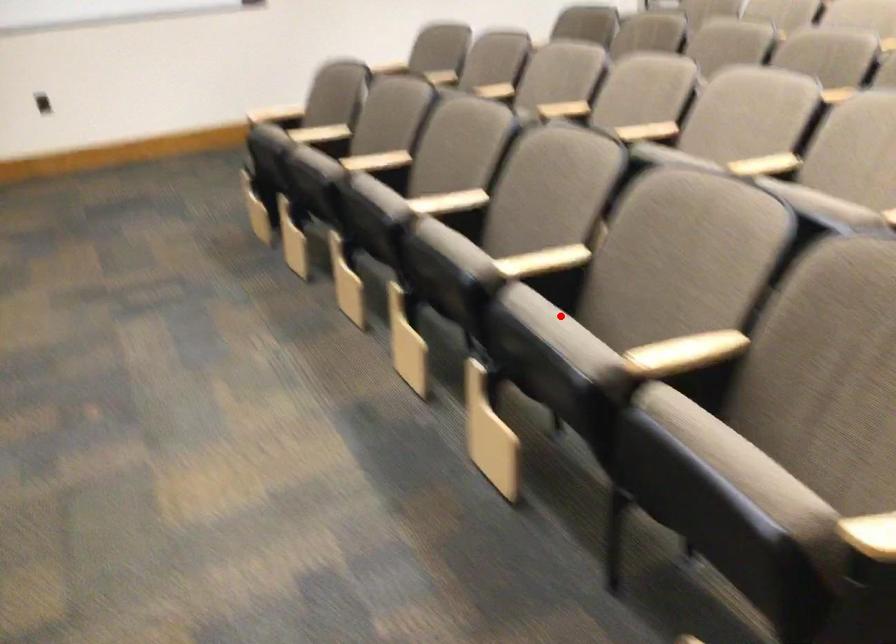
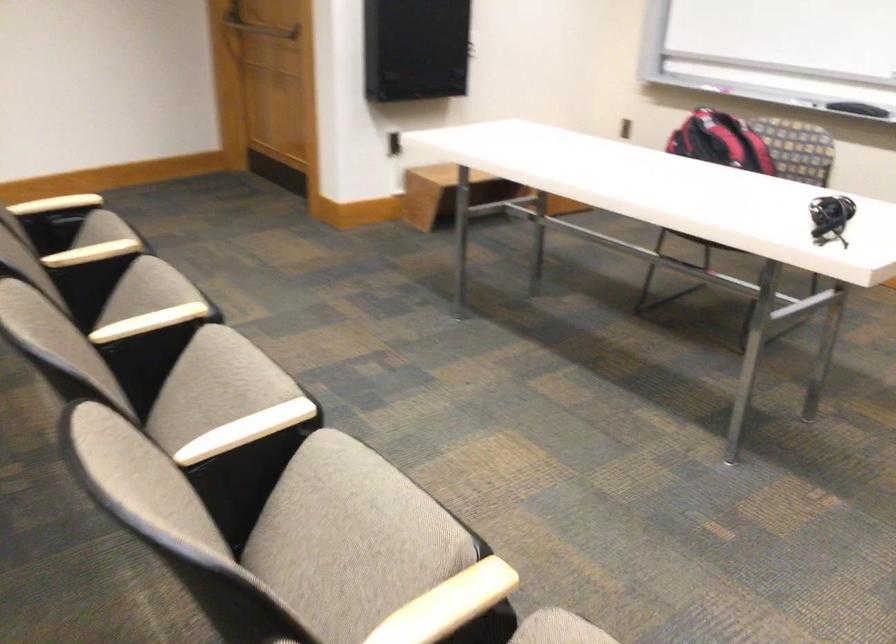
Where in the second image is the point corresponding to the highlighted location from the first image?

(147, 290)